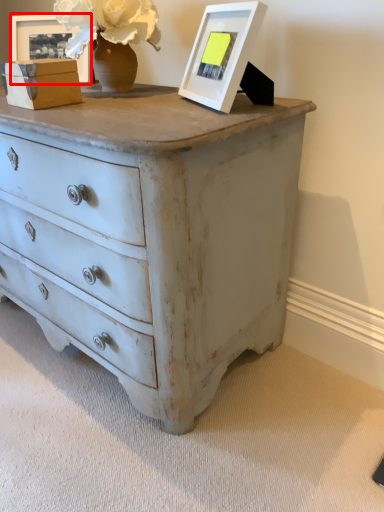
Question: From the image, what is the correct spatial relationship of picture frame (annotated by the red box) in relation to picture frame?

Choices:
 (A) left
 (B) right

Answer: (A)